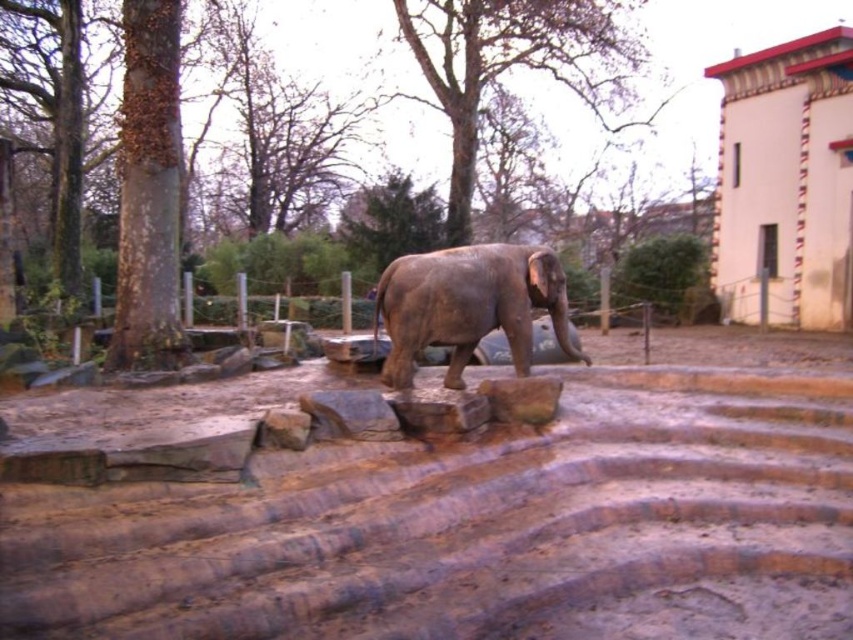
Does white painted wall at upper right appear on the right side of gray textured elephant at center?

Correct, you'll find white painted wall at upper right to the right of gray textured elephant at center.

Which is in front, point (751, 252) or point (456, 292)?

Point (456, 292)

Locate an element on the screen. Image resolution: width=853 pixels, height=640 pixels. white painted wall at upper right is located at coordinates (786, 180).

In order to click on brown sandy dirt at center in this screenshot , I will do `click(486, 522)`.

Is brown sandy dirt at center to the left of gray textured elephant at center from the viewer's perspective?

In fact, brown sandy dirt at center is to the right of gray textured elephant at center.

What do you see at coordinates (486, 522) in the screenshot? The width and height of the screenshot is (853, 640). I see `brown sandy dirt at center` at bounding box center [486, 522].

This screenshot has height=640, width=853. Find the location of `brown sandy dirt at center`. brown sandy dirt at center is located at coordinates (486, 522).

The width and height of the screenshot is (853, 640). Find the location of `brown sandy dirt at center`. brown sandy dirt at center is located at coordinates (486, 522).

Does point (740, 525) come behind point (759, 72)?

No, it is in front of (759, 72).

Find the location of `brown sandy dirt at center`. brown sandy dirt at center is located at coordinates (486, 522).